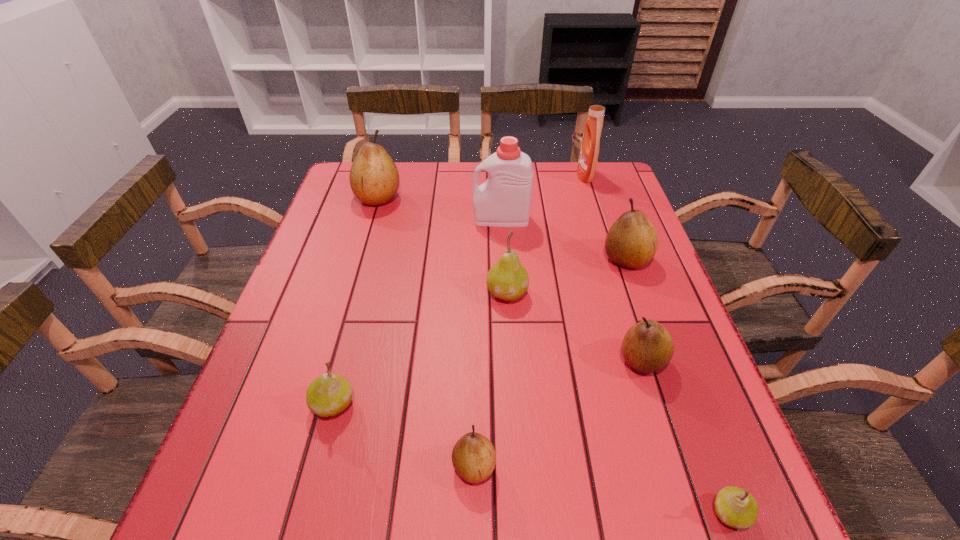
Where is `detergent that is at the far edge`? detergent that is at the far edge is located at coordinates tap(589, 151).

You are a GUI agent. You are given a task and a screenshot of the screen. Output one action in this format:
    pyautogui.click(x=<x>, y=<y>)
    Task: Click on the pear that is at the far edge
    The width and height of the screenshot is (960, 540).
    Given the screenshot: What is the action you would take?
    pyautogui.click(x=374, y=179)

Where is `detergent at the right edge`? detergent at the right edge is located at coordinates (589, 151).

This screenshot has height=540, width=960. Identify the location of object located in the far left corner section of the desktop. (374, 179).

At what (x,y) coordinates should I click in order to perform the action: click on object that is at the far right corner. Please return your answer as a coordinate pair (x, y). This screenshot has width=960, height=540. Looking at the image, I should click on (589, 151).

Find the location of `object located in the near right corner section of the desktop`. object located in the near right corner section of the desktop is located at coordinates (736, 507).

Locate an element on the screen. The image size is (960, 540). free region at the far edge of the desktop is located at coordinates (421, 192).

This screenshot has width=960, height=540. What are the coordinates of `free space at the near edge of the desktop` in the screenshot? It's located at (531, 536).

Where is `vacant region at the left edge of the desktop`? vacant region at the left edge of the desktop is located at coordinates (348, 293).

You are a GUI agent. You are given a task and a screenshot of the screen. Output one action in this format:
    pyautogui.click(x=<x>, y=<y>)
    Task: Click on the free space at the right edge of the desktop
    The width and height of the screenshot is (960, 540).
    Given the screenshot: What is the action you would take?
    pyautogui.click(x=623, y=359)